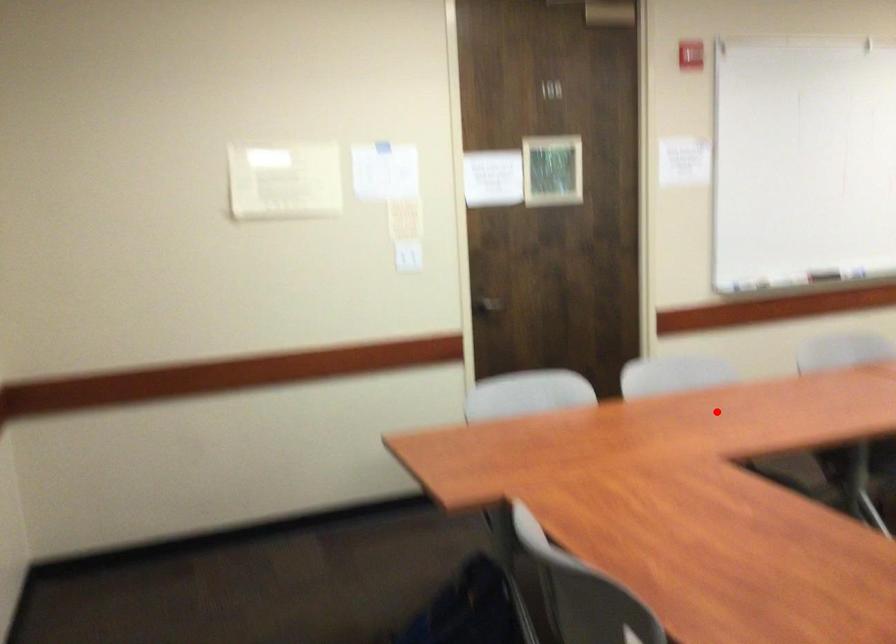
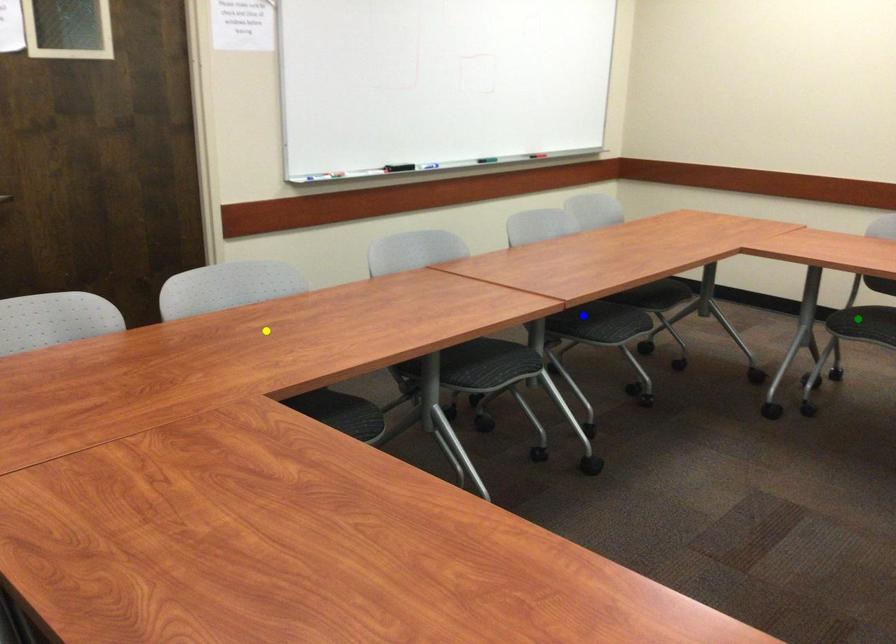
Question: I am providing you with two images of the same scene from different viewpoints. A red point is marked on the first image. You are given multiple points on the second image. In image 2, which mark is for the same physical point as the one in image 1?

Choices:
 (A) green point
 (B) blue point
 (C) yellow point

Answer: (C)